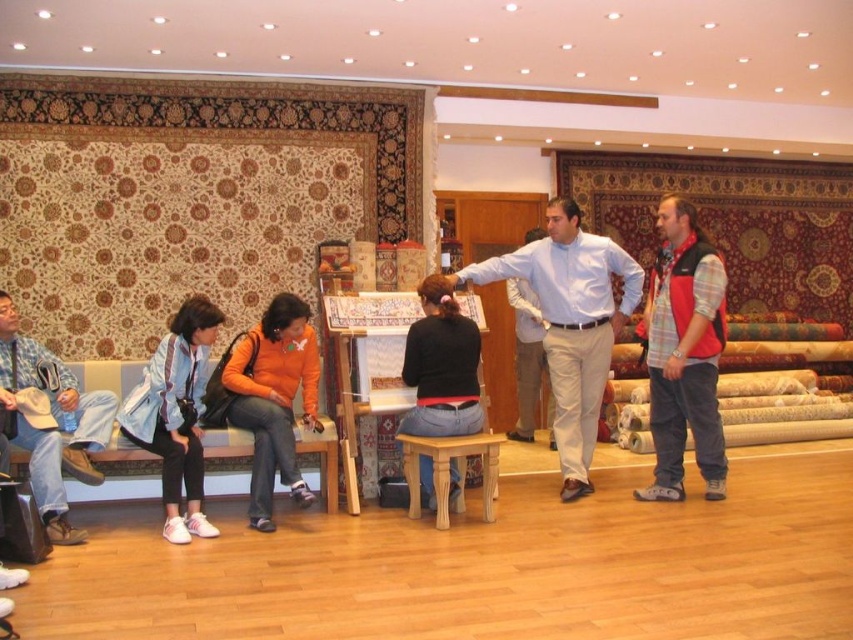
Between red plaid shirt at right and denim jeans at left, which one has more height?

red plaid shirt at right is taller.

Describe the element at coordinates (683, 355) in the screenshot. I see `red plaid shirt at right` at that location.

Is point (671, 317) behind point (54, 449)?

Yes, it is behind point (54, 449).

This screenshot has height=640, width=853. Identify the location of red plaid shirt at right. (683, 355).

Can you confirm if orange fabric jacket at center is bigger than denim jeans at left?

Correct, orange fabric jacket at center is larger in size than denim jeans at left.

Who is shorter, orange fabric jacket at center or denim jeans at left?

denim jeans at left

The height and width of the screenshot is (640, 853). I want to click on orange fabric jacket at center, so click(x=271, y=397).

Where is `orange fabric jacket at center`? Image resolution: width=853 pixels, height=640 pixels. orange fabric jacket at center is located at coordinates (271, 397).

Who is positioned more to the left, light blue shirt at center or white shirt at center?

From the viewer's perspective, light blue shirt at center appears more on the left side.

Find the location of a particular element. light blue shirt at center is located at coordinates click(572, 323).